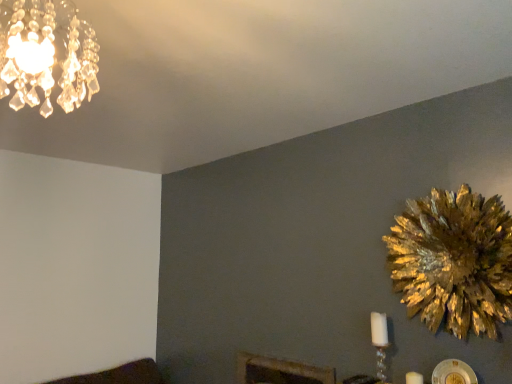
I want to click on crystal glass chandelier at upper left, so click(x=46, y=55).

What do you see at coordinates (414, 378) in the screenshot? I see `white matte candle at lower right` at bounding box center [414, 378].

Measure the distance between point (x=379, y=379) and camera.

Point (x=379, y=379) and camera are 1.99 meters apart.

The width and height of the screenshot is (512, 384). In order to click on crystal glass chandelier at upper left in this screenshot , I will do `click(46, 55)`.

Is point (4, 63) farther from viewer compared to point (413, 382)?

No, it is not.

Can you confirm if crystal glass chandelier at upper left is taller than white matte candle at lower right?

Yes, crystal glass chandelier at upper left is taller than white matte candle at lower right.

Is crystal glass chandelier at upper left to the left of white matte candle at lower right from the viewer's perspective?

Correct, you'll find crystal glass chandelier at upper left to the left of white matte candle at lower right.

Consider the image. Considering the sizes of objects white matte candle at lower right and crystal glass chandelier at upper left in the image provided, who is thinner, white matte candle at lower right or crystal glass chandelier at upper left?

Thinner between the two is white matte candle at lower right.

In order to click on candle lying on the right of crystal glass chandelier at upper left in this screenshot , I will do `click(414, 378)`.

From a real-world perspective, is white matte candle at lower right under crystal glass chandelier at upper left?

Yes.

From a real-world perspective, who is located higher, white matte candle at lower right or gold metallic flower at right?

From a 3D spatial view, gold metallic flower at right is above.

Which object is closer to the camera, white matte candle at lower right or gold metallic flower at right?

gold metallic flower at right is more forward.

Is white matte candle at lower right not near gold metallic flower at right?

white matte candle at lower right is actually quite close to gold metallic flower at right.

From the image's perspective, is white matte candle at lower right located beneath gold metallic flower at right?

Yes.

Considering the relative positions of gold metallic flower at right and white glass candle at lower right in the image provided, is gold metallic flower at right to the right of white glass candle at lower right from the viewer's perspective?

Correct, you'll find gold metallic flower at right to the right of white glass candle at lower right.

Is gold metallic flower at right facing towards white glass candle at lower right?

No, gold metallic flower at right is not oriented towards white glass candle at lower right.

Is gold metallic flower at right inside the boundaries of white glass candle at lower right, or outside?

gold metallic flower at right is not inside white glass candle at lower right, it's outside.

Is gold metallic flower at right far from white glass candle at lower right?

gold metallic flower at right is actually quite close to white glass candle at lower right.

Which object is closer to the camera, white matte candle at lower right or white glass candle at lower right?

Positioned in front is white matte candle at lower right.

Which of these two, white matte candle at lower right or white glass candle at lower right, is thinner?

white matte candle at lower right.

From the image's perspective, is white matte candle at lower right below white glass candle at lower right?

Indeed, from the image's perspective, white matte candle at lower right is shown beneath white glass candle at lower right.

Considering the positions of objects white glass candle at lower right and gold metallic flower at right in the image provided, who is more to the left, white glass candle at lower right or gold metallic flower at right?

From the viewer's perspective, white glass candle at lower right appears more on the left side.

Is white glass candle at lower right next to gold metallic flower at right and touching it?

There is a gap between white glass candle at lower right and gold metallic flower at right.

Who is shorter, white glass candle at lower right or gold metallic flower at right?

white glass candle at lower right is shorter.

Is point (67, 54) closer to viewer compared to point (426, 294)?

Yes.

Relative to gold metallic flower at right, is crystal glass chandelier at upper left in front or behind?

crystal glass chandelier at upper left is in front of gold metallic flower at right.

From the image's perspective, is crystal glass chandelier at upper left positioned above or below gold metallic flower at right?

Based on their image positions, crystal glass chandelier at upper left is located above gold metallic flower at right.

From a real-world perspective, is crystal glass chandelier at upper left above or below gold metallic flower at right?

Clearly, from a real-world perspective, crystal glass chandelier at upper left is above gold metallic flower at right.

The height and width of the screenshot is (384, 512). I want to click on candle lying on the right of crystal glass chandelier at upper left, so click(414, 378).

Where is `candle behind the crystal glass chandelier at upper left`? candle behind the crystal glass chandelier at upper left is located at coordinates (414, 378).

Looking at the image, which one is located closer to crystal glass chandelier at upper left, white matte candle at lower right or white glass candle at lower right?

white glass candle at lower right.

Consider the image. Considering their positions, is crystal glass chandelier at upper left positioned further to white glass candle at lower right than white matte candle at lower right?

Among the two, crystal glass chandelier at upper left is located further to white glass candle at lower right.

From the image, which object appears to be farther from white matte candle at lower right, crystal glass chandelier at upper left or white glass candle at lower right?

Among the two, crystal glass chandelier at upper left is located further to white matte candle at lower right.

When comparing their distances from gold metallic flower at right, does crystal glass chandelier at upper left or white glass candle at lower right seem closer?

white glass candle at lower right lies closer to gold metallic flower at right than the other object.

Considering their positions, is crystal glass chandelier at upper left positioned further to white glass candle at lower right than gold metallic flower at right?

crystal glass chandelier at upper left is positioned further to the anchor white glass candle at lower right.

Which object lies further to the anchor point white glass candle at lower right, gold metallic flower at right or white matte candle at lower right?

gold metallic flower at right.

Based on the photo, based on their spatial positions, is white glass candle at lower right or white matte candle at lower right closer to gold metallic flower at right?

white glass candle at lower right is closer to gold metallic flower at right.

Considering their positions, is gold metallic flower at right positioned closer to white glass candle at lower right than crystal glass chandelier at upper left?

Among the two, gold metallic flower at right is located nearer to white glass candle at lower right.

You are a GUI agent. You are given a task and a screenshot of the screen. Output one action in this format:
    pyautogui.click(x=<x>, y=<y>)
    Task: Click on the candle between crystal glass chandelier at upper left and gold metallic flower at right from left to right
    The width and height of the screenshot is (512, 384).
    Given the screenshot: What is the action you would take?
    pyautogui.click(x=414, y=378)

Identify the location of candle holder between crystal glass chandelier at upper left and gold metallic flower at right from left to right. (x=380, y=343).

You are a GUI agent. You are given a task and a screenshot of the screen. Output one action in this format:
    pyautogui.click(x=<x>, y=<y>)
    Task: Click on the candle holder between crystal glass chandelier at upper left and white matte candle at lower right in the vertical direction
    
    Given the screenshot: What is the action you would take?
    pyautogui.click(x=380, y=343)

Find the location of a particular element. candle holder between gold metallic flower at right and white matte candle at lower right in the vertical direction is located at coordinates (x=380, y=343).